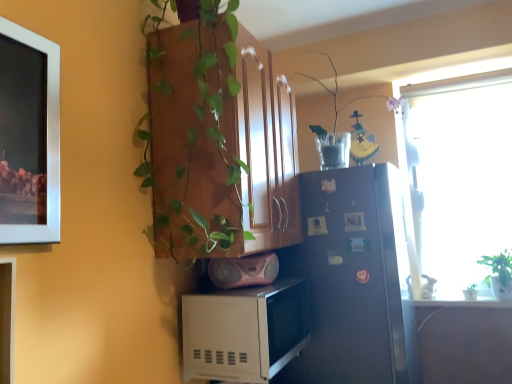
Question: Would you say clear glass vase at upper right is part of satin black refrigerator at right's contents?

Choices:
 (A) no
 (B) yes

Answer: (A)

Question: Considering the relative sizes of satin black refrigerator at right and clear glass vase at upper right in the image provided, is satin black refrigerator at right bigger than clear glass vase at upper right?

Choices:
 (A) yes
 (B) no

Answer: (A)

Question: Is satin black refrigerator at right positioned far away from clear glass vase at upper right?

Choices:
 (A) yes
 (B) no

Answer: (B)

Question: From a real-world perspective, does satin black refrigerator at right stand above clear glass vase at upper right?

Choices:
 (A) yes
 (B) no

Answer: (B)

Question: From the image's perspective, is satin black refrigerator at right above clear glass vase at upper right?

Choices:
 (A) yes
 (B) no

Answer: (B)

Question: Can you confirm if satin black refrigerator at right is positioned to the left of clear glass vase at upper right?

Choices:
 (A) no
 (B) yes

Answer: (B)

Question: Does green leafy plant at right have a lesser width compared to wooden cabinet at upper center?

Choices:
 (A) no
 (B) yes

Answer: (B)

Question: Can you confirm if green leafy plant at right is positioned to the right of wooden cabinet at upper center?

Choices:
 (A) yes
 (B) no

Answer: (A)

Question: Are green leafy plant at right and wooden cabinet at upper center making contact?

Choices:
 (A) no
 (B) yes

Answer: (A)

Question: Does green leafy plant at right appear on the left side of wooden cabinet at upper center?

Choices:
 (A) yes
 (B) no

Answer: (B)

Question: Is green leafy plant at right closer to the viewer compared to wooden cabinet at upper center?

Choices:
 (A) no
 (B) yes

Answer: (A)

Question: Is green leafy plant at right not within wooden cabinet at upper center?

Choices:
 (A) no
 (B) yes

Answer: (B)

Question: Is satin black refrigerator at right positioned before white matte microwave at lower center?

Choices:
 (A) no
 (B) yes

Answer: (A)